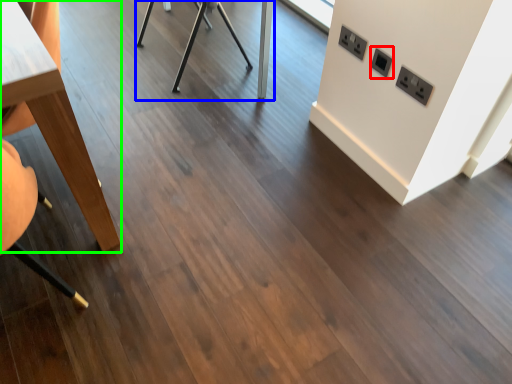
Question: Estimate the real-world distances between objects in this image. Which object is closer to electric outlet (highlighted by a red box), table (highlighted by a blue box) or table (highlighted by a green box)?

Choices:
 (A) table
 (B) table

Answer: (B)